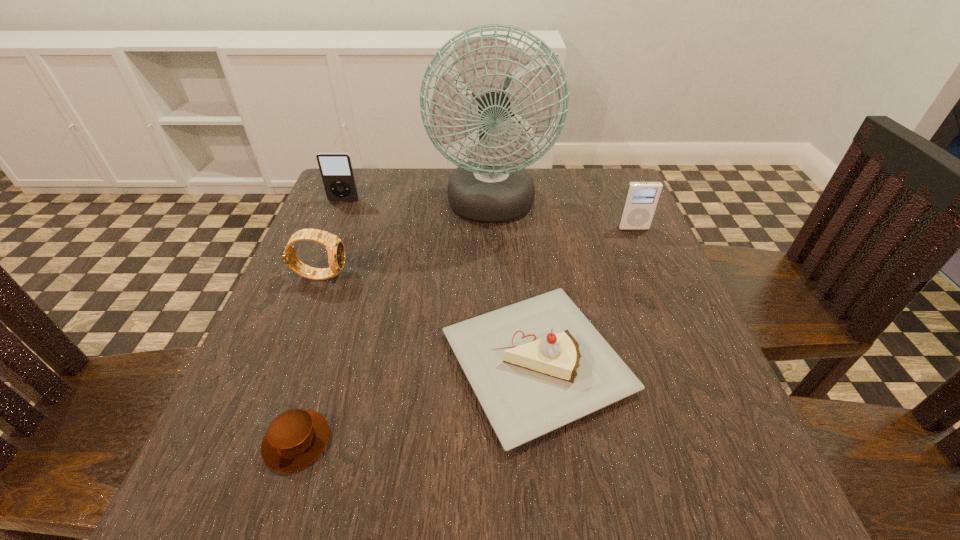
Where is `free region that satisfies the following two spatial constraints: 1. on the face of the fourth farthest object; 2. on the left side of the cake`? free region that satisfies the following two spatial constraints: 1. on the face of the fourth farthest object; 2. on the left side of the cake is located at coordinates (286, 363).

Locate an element on the screen. vacant area that satisfies the following two spatial constraints: 1. on the face of the muffin; 2. on the right side of the watch is located at coordinates (256, 441).

Find the location of a particular element. This screenshot has width=960, height=540. vacant space that satisfies the following two spatial constraints: 1. on the face of the shortest object; 2. on the right side of the third nearest object is located at coordinates (256, 441).

Where is `free space that satisfies the following two spatial constraints: 1. on the face of the watch; 2. on the back side of the shortest object`? This screenshot has height=540, width=960. free space that satisfies the following two spatial constraints: 1. on the face of the watch; 2. on the back side of the shortest object is located at coordinates (256, 441).

Find the location of a particular element. The height and width of the screenshot is (540, 960). free space that satisfies the following two spatial constraints: 1. on the back side of the cake; 2. on the face of the watch is located at coordinates (527, 274).

Where is `vacant position in the image that satisfies the following two spatial constraints: 1. on the front-facing side of the nearer iPod; 2. on the face of the fourth farthest object`? vacant position in the image that satisfies the following two spatial constraints: 1. on the front-facing side of the nearer iPod; 2. on the face of the fourth farthest object is located at coordinates (653, 274).